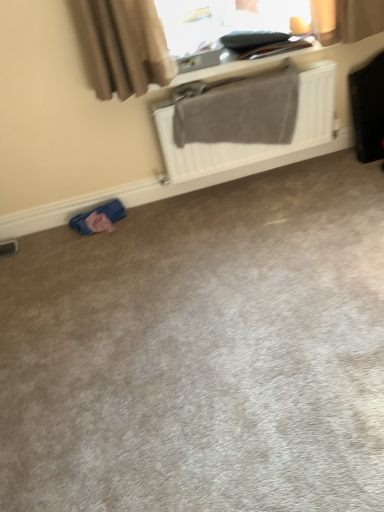
Question: Is black leather suitcase at right inside the boundaries of white matte radiator at upper center, or outside?

Choices:
 (A) inside
 (B) outside

Answer: (B)

Question: Looking at the image, does black leather suitcase at right seem bigger or smaller compared to white matte radiator at upper center?

Choices:
 (A) small
 (B) big

Answer: (A)

Question: Which object is positioned closest to the black leather suitcase at right?

Choices:
 (A) beige fabric curtain at upper left
 (B) white matte radiator at upper center
 (C) gray carpet at lower left
 (D) blue fabric at lower left

Answer: (B)

Question: Which object is the closest to the gray carpet at lower left?

Choices:
 (A) white matte radiator at upper center
 (B) blue fabric at lower left
 (C) black leather suitcase at right
 (D) beige fabric curtain at upper left

Answer: (B)